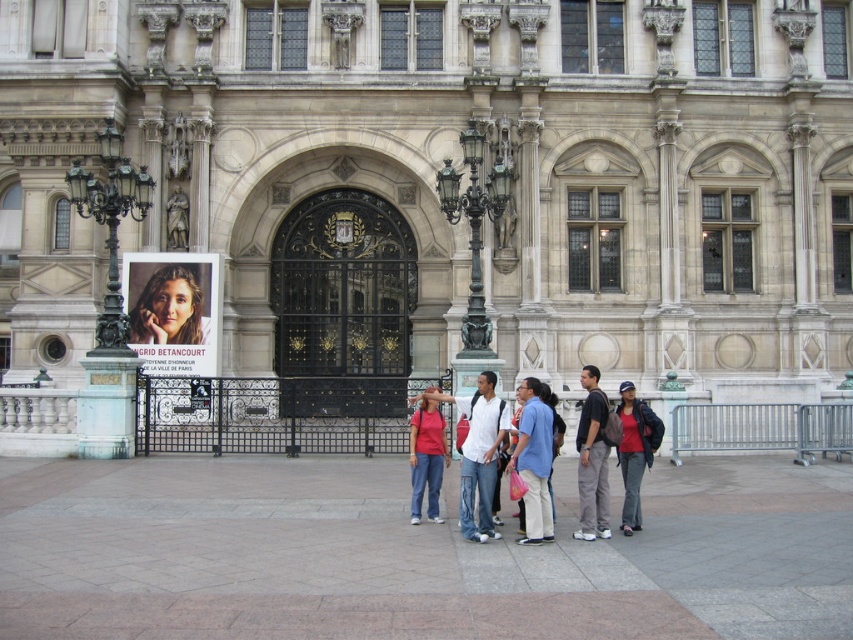
Who is more forward, (550, 436) or (621, 404)?

Positioned in front is point (550, 436).

Does blue cotton shirt at center have a greater height compared to matte red shirt at center?

Indeed, blue cotton shirt at center has a greater height compared to matte red shirt at center.

The image size is (853, 640). I want to click on blue cotton shirt at center, so click(x=534, y=460).

Is matte pink shirt at center thinner than blue cotton shirt at center?

No.

Can you confirm if matte pink shirt at center is smaller than blue cotton shirt at center?

No, matte pink shirt at center is not smaller than blue cotton shirt at center.

Measure the distance between matte pink shirt at center and camera.

matte pink shirt at center is 23.08 meters away from camera.

You are a GUI agent. You are given a task and a screenshot of the screen. Output one action in this format:
    pyautogui.click(x=<x>, y=<y>)
    Task: Click on the matte pink shirt at center
    Image resolution: width=853 pixels, height=640 pixels.
    Given the screenshot: What is the action you would take?
    pyautogui.click(x=477, y=452)

Which is below, dark gray pants at center or light blue shirt at center?

light blue shirt at center is lower down.

Locate an element on the screen. This screenshot has width=853, height=640. dark gray pants at center is located at coordinates (592, 460).

Locate an element on the screen. The image size is (853, 640). dark gray pants at center is located at coordinates click(592, 460).